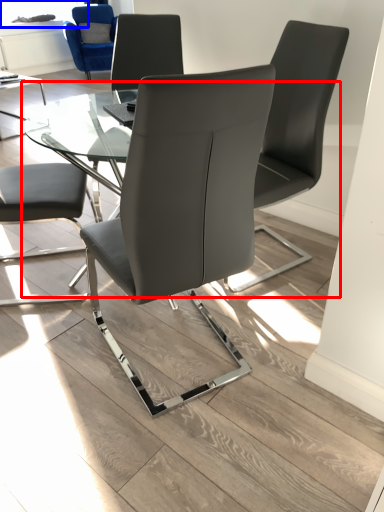
Question: Which point is closer to the camera, round table (highlighted by a red box) or window screen (highlighted by a blue box)?

Choices:
 (A) round table
 (B) window screen

Answer: (A)